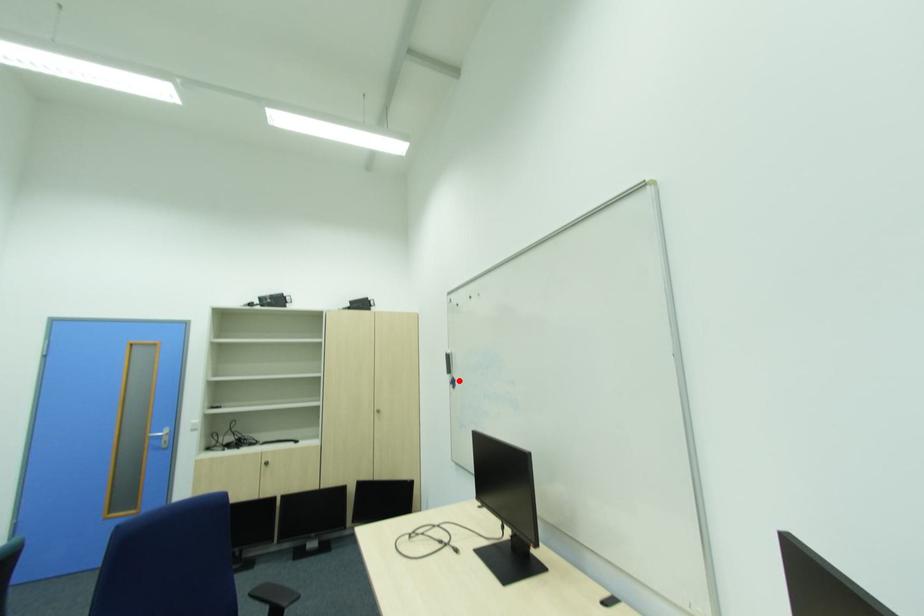
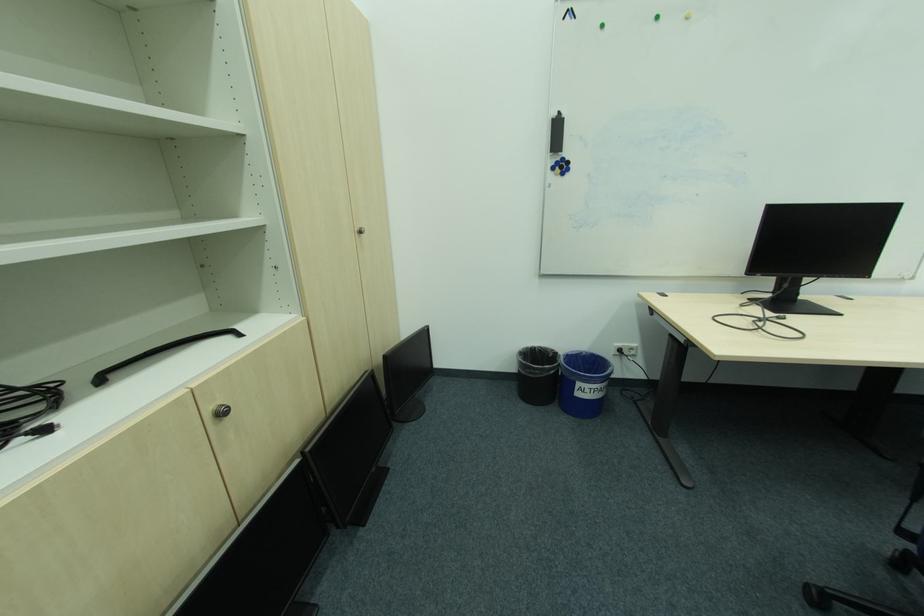
Question: I am providing you with two images of the same scene from different viewpoints. A red point is marked on the first image. At the location where the point appears in image 1, is it still visible in image 2?

Choices:
 (A) Yes
 (B) No

Answer: (A)